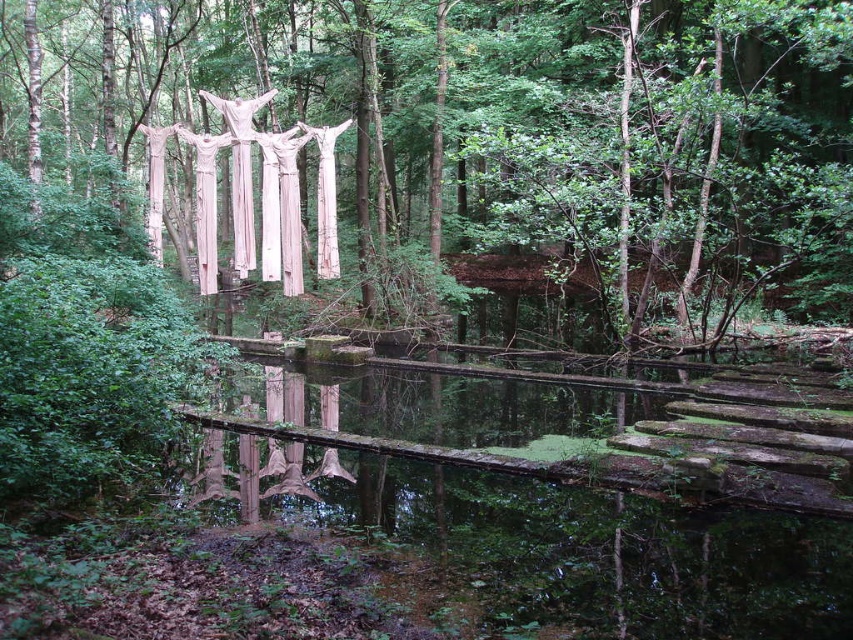
Does point (234, 80) come farther from viewer compared to point (682, 451)?

That is True.

Identify the location of smooth white sculpture at center. This screenshot has width=853, height=640. (463, 145).

Who is more forward, (228, 218) or (836, 628)?

Positioned in front is point (836, 628).

At what (x,y) coordinates should I click in order to perform the action: click on smooth white sculpture at center. Please return your answer as a coordinate pair (x, y). The image size is (853, 640). Looking at the image, I should click on (463, 145).